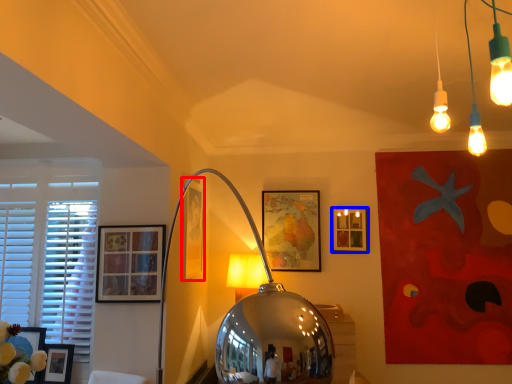
Question: Which object is closer to the camera taking this photo, picture frame (highlighted by a red box) or picture frame (highlighted by a blue box)?

Choices:
 (A) picture frame
 (B) picture frame

Answer: (A)